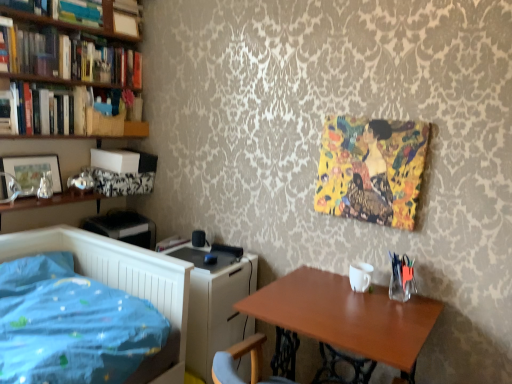
The width and height of the screenshot is (512, 384). I want to click on empty space that is ontop of white glossy computer desk at center (from a real-world perspective), so click(x=217, y=259).